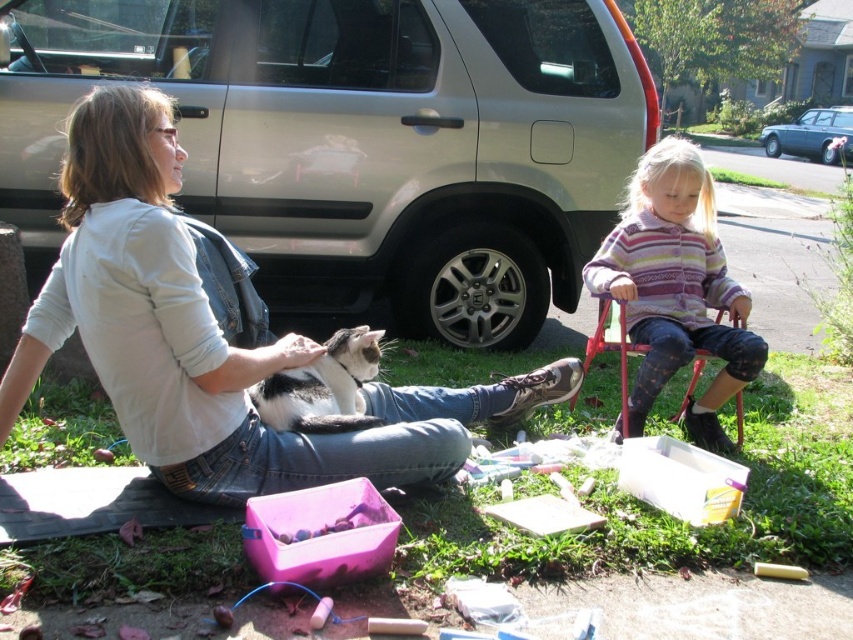
Question: Where is silver metallic suv at center located in relation to striped sweater at center in the image?

Choices:
 (A) above
 (B) below

Answer: (A)

Question: Which point appears farthest from the camera in this image?

Choices:
 (A) (676, 340)
 (B) (839, 120)

Answer: (B)

Question: Considering the real-world distances, which object is closest to the matte white shirt at center?

Choices:
 (A) gray-black fur cat at center
 (B) striped sweater at center
 (C) teal metallic sedan at upper right
 (D) silver metallic suv at center

Answer: (A)

Question: Can you confirm if silver metallic suv at center is bigger than striped sweater at center?

Choices:
 (A) no
 (B) yes

Answer: (B)

Question: Which of these objects is positioned closest to the silver metallic suv at center?

Choices:
 (A) gray-black fur cat at center
 (B) teal metallic sedan at upper right

Answer: (A)

Question: In this image, where is silver metallic suv at center located relative to teal metallic sedan at upper right?

Choices:
 (A) left
 (B) right

Answer: (A)